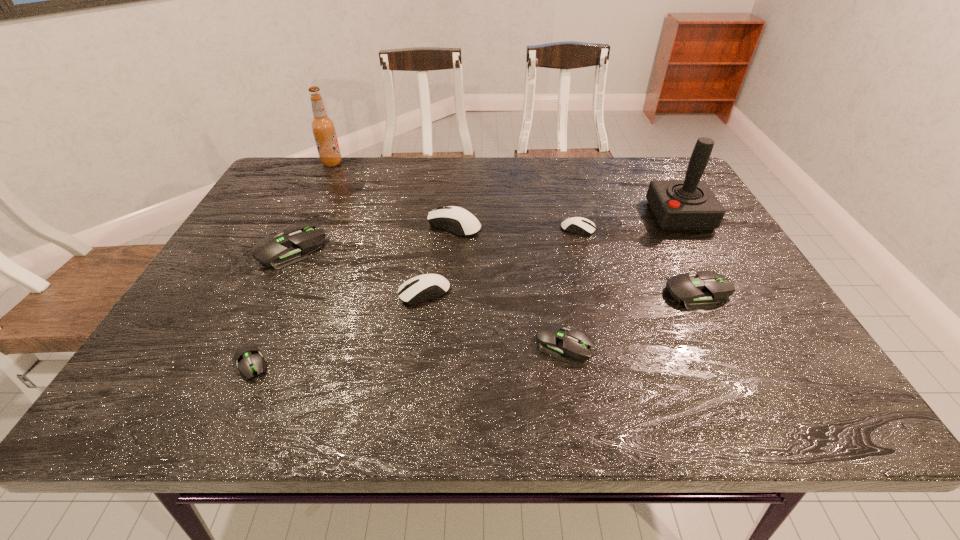
At what (x,y) coordinates should I click in order to perform the action: click on the shortest object. Please return your answer as a coordinate pair (x, y). The width and height of the screenshot is (960, 540). Looking at the image, I should click on (248, 358).

In order to click on the smallest gray computer mouse in this screenshot , I will do `click(248, 358)`.

Locate an element on the screen. The width and height of the screenshot is (960, 540). vacant space located on the front label of the farthest object is located at coordinates (398, 163).

Where is `vacant position located on the base of the joystick`? The width and height of the screenshot is (960, 540). vacant position located on the base of the joystick is located at coordinates (528, 215).

In order to click on vacant region located on the base of the joystick in this screenshot , I will do pyautogui.click(x=558, y=215).

Identify the location of free space located 0.160m on the base of the joystick. The height and width of the screenshot is (540, 960). (593, 215).

The width and height of the screenshot is (960, 540). In order to click on free point located on the back of the biggest white mouse in this screenshot , I will do `click(457, 184)`.

You are a GUI agent. You are given a task and a screenshot of the screen. Output one action in this format:
    pyautogui.click(x=<x>, y=<y>)
    Task: Click on the free space located on the back of the biggest gray computer mouse
    
    Given the screenshot: What is the action you would take?
    [317, 198]

Image resolution: width=960 pixels, height=540 pixels. In order to click on vacant space situated 0.050m on the right of the nearest white mouse in this screenshot , I will do `click(471, 293)`.

The width and height of the screenshot is (960, 540). Find the location of `vacant position located 0.130m on the front of the rightmost computer mouse`. vacant position located 0.130m on the front of the rightmost computer mouse is located at coordinates (732, 358).